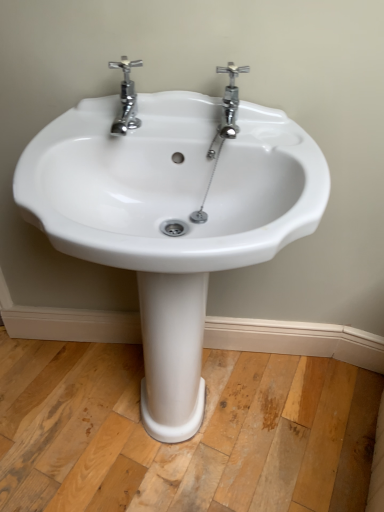
Question: Is chrome/metallic faucet at upper left, the first tap from the left, bigger or smaller than chrome/metallic faucet at upper center, the first tap in the right-to-left sequence?

Choices:
 (A) small
 (B) big

Answer: (B)

Question: From a real-world perspective, is chrome/metallic faucet at upper left, positioned as the second tap in right-to-left order, positioned above or below chrome/metallic faucet at upper center, marked as the 2th tap in a left-to-right arrangement?

Choices:
 (A) above
 (B) below

Answer: (A)

Question: Based on their relative distances, which object is nearer to the white ceramic sink at center?

Choices:
 (A) chrome/metallic faucet at upper center, the first tap in the right-to-left sequence
 (B) chrome/metallic faucet at upper left, the first tap from the left

Answer: (B)

Question: Estimate the real-world distances between objects in this image. Which object is closer to the chrome/metallic faucet at upper center, the first tap in the right-to-left sequence?

Choices:
 (A) chrome/metallic faucet at upper left, positioned as the second tap in right-to-left order
 (B) white ceramic sink at center

Answer: (A)